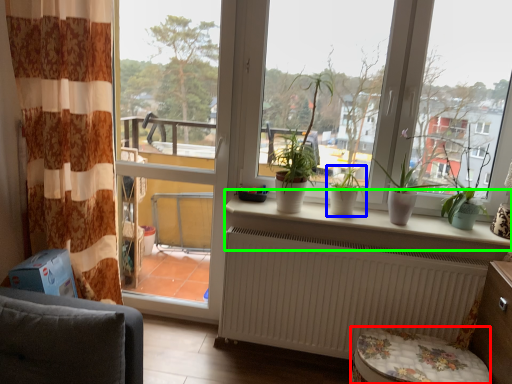
Question: Which object is positioned closest to music stool (highlighted by a red box)? Select from houseplant (highlighted by a blue box) and window sill (highlighted by a green box).

Choices:
 (A) houseplant
 (B) window sill

Answer: (B)